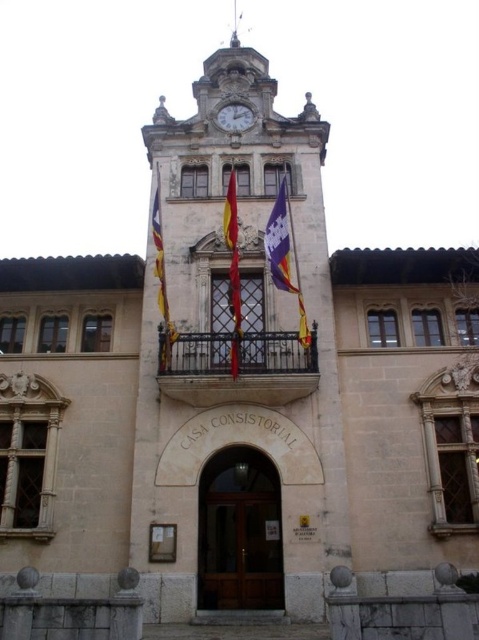
Looking at this image, you are standing in front of the CASA CONSISTORIAL building and notice two features at the center of its facade. There is a black wrought iron balcony at center and a purple fabric flag at center. Which of these two items is positioned to the left when viewed from your perspective?

The black wrought iron balcony at center is to the left of the purple fabric flag at center according to the description.

You are standing in front of the CASA CONSISTORIAL building and want to enter through the brown wooden door at center. The stone clock tower at center has a clock face that shows the current time. If you walk straight towards the door, will you pass by the clock tower?

The stone clock tower at center is 25.44 feet away from brown wooden door at center. Since both are at the center of the building, walking straight towards the door would mean passing directly in front of the clock tower, so yes, you will pass by the stone clock tower at center on your way to the door.